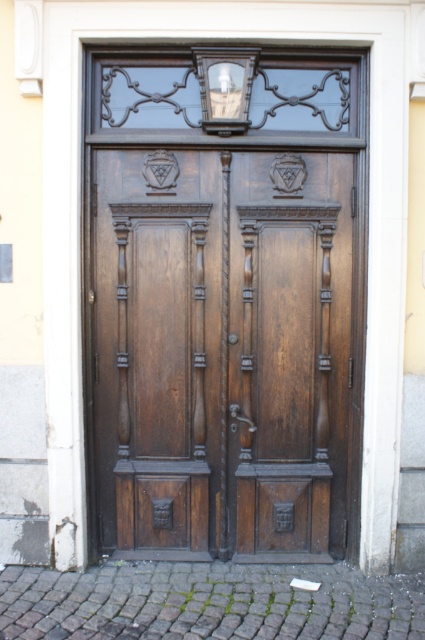
Which of these two, polished wood door at center or matte glass lamp at upper center, stands taller?

Standing taller between the two is polished wood door at center.

Can you confirm if polished wood door at center is taller than matte glass lamp at upper center?

Indeed, polished wood door at center has a greater height compared to matte glass lamp at upper center.

Is point (331, 348) less distant than point (237, 83)?

No, it is behind (237, 83).

Locate an element on the screen. polished wood door at center is located at coordinates (224, 307).